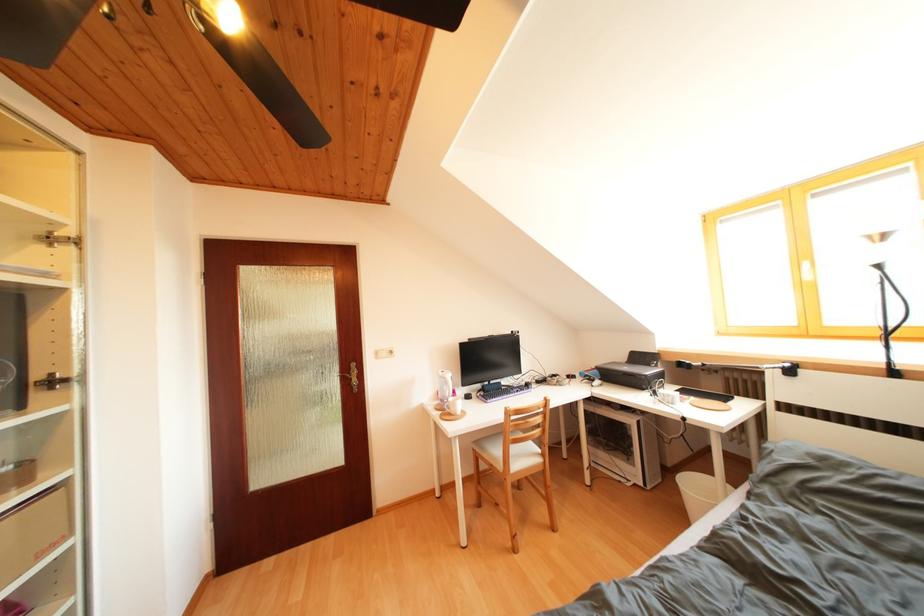
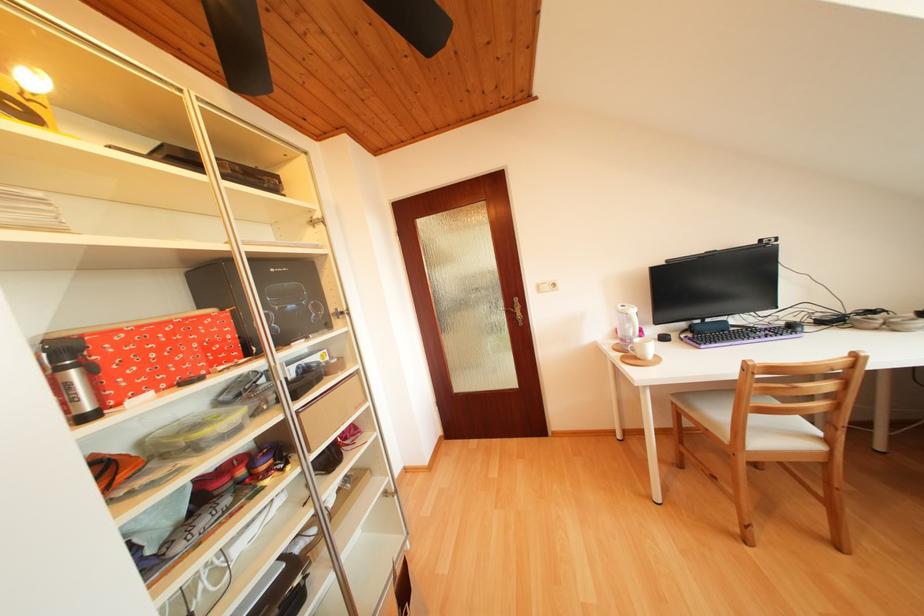
Where in the second image is the point corresponding to (454,392) from the first image?

(636, 331)